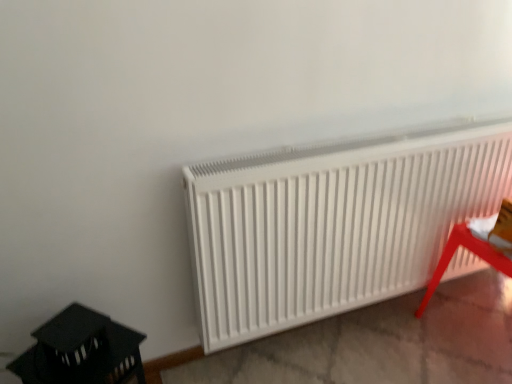
Identify the location of metallic red stool at lower right, which is counted as the 1th furniture, starting from the right. This screenshot has width=512, height=384. (476, 249).

Identify the location of white matte radiator at center. Image resolution: width=512 pixels, height=384 pixels. (333, 223).

Is black plastic lantern at lower left, which is the second furniture from right to left, looking in the opposite direction of metallic red stool at lower right, which is the second furniture in left-to-right order?

No, black plastic lantern at lower left, which is the second furniture from right to left,'s orientation is not away from metallic red stool at lower right, which is the second furniture in left-to-right order.

How many degrees apart are the facing directions of black plastic lantern at lower left, which appears as the 1th furniture when viewed from the left, and metallic red stool at lower right, which is counted as the 1th furniture, starting from the right?

41.2 degrees separate the facing orientations of black plastic lantern at lower left, which appears as the 1th furniture when viewed from the left, and metallic red stool at lower right, which is counted as the 1th furniture, starting from the right.

From a real-world perspective, is black plastic lantern at lower left, which is the second furniture from right to left, below metallic red stool at lower right, which is the second furniture in left-to-right order?

No.

Is there a large distance between black plastic lantern at lower left, which is the second furniture from right to left, and metallic red stool at lower right, which is counted as the 1th furniture, starting from the right?

Yes.

Is white matte radiator at center bigger than black plastic lantern at lower left, which is the second furniture from right to left?

Yes.

Is white matte radiator at center facing away from black plastic lantern at lower left, which appears as the 1th furniture when viewed from the left?

No.

From the picture: Does white matte radiator at center have a lesser height compared to black plastic lantern at lower left, which is the second furniture from right to left?

No.

Looking at this image, is black plastic lantern at lower left, which appears as the 1th furniture when viewed from the left, located within white matte radiator at center?

Actually, black plastic lantern at lower left, which appears as the 1th furniture when viewed from the left, is outside white matte radiator at center.

Considering the relative positions of white matte radiator at center and metallic red stool at lower right, which is counted as the 1th furniture, starting from the right, in the image provided, is white matte radiator at center to the left of metallic red stool at lower right, which is counted as the 1th furniture, starting from the right, from the viewer's perspective?

Yes, white matte radiator at center is to the left of metallic red stool at lower right, which is counted as the 1th furniture, starting from the right.

In the scene shown: Is metallic red stool at lower right, which is the second furniture in left-to-right order, a part of white matte radiator at center?

Actually, metallic red stool at lower right, which is the second furniture in left-to-right order, is outside white matte radiator at center.

From a real-world perspective, is white matte radiator at center physically located above or below metallic red stool at lower right, which is the second furniture in left-to-right order?

In terms of real-world spatial position, white matte radiator at center is above metallic red stool at lower right, which is the second furniture in left-to-right order.

Considering their positions, is white matte radiator at center located in front of or behind metallic red stool at lower right, which is the second furniture in left-to-right order?

Clearly, white matte radiator at center is in front of metallic red stool at lower right, which is the second furniture in left-to-right order.

Between black plastic lantern at lower left, which is the second furniture from right to left, and white matte radiator at center, which one has smaller size?

Smaller between the two is black plastic lantern at lower left, which is the second furniture from right to left.

Is black plastic lantern at lower left, which is the second furniture from right to left, closer to camera compared to white matte radiator at center?

Yes, black plastic lantern at lower left, which is the second furniture from right to left, is in front of white matte radiator at center.

Does point (95, 358) appear closer or farther from the camera than point (275, 273)?

Clearly, point (95, 358) is closer to the camera than point (275, 273).

Which object is positioned more to the right, black plastic lantern at lower left, which appears as the 1th furniture when viewed from the left, or white matte radiator at center?

From the viewer's perspective, white matte radiator at center appears more on the right side.

Could you measure the distance between metallic red stool at lower right, which is the second furniture in left-to-right order, and white matte radiator at center?

14.22 inches.

From the picture: From a real-world perspective, is metallic red stool at lower right, which is counted as the 1th furniture, starting from the right, on white matte radiator at center?

Actually, metallic red stool at lower right, which is counted as the 1th furniture, starting from the right, is physically below white matte radiator at center in the real world.

Is metallic red stool at lower right, which is the second furniture in left-to-right order, in front of or behind white matte radiator at center in the image?

Visually, metallic red stool at lower right, which is the second furniture in left-to-right order, is located behind white matte radiator at center.

Is metallic red stool at lower right, which is the second furniture in left-to-right order, in contact with white matte radiator at center?

No, metallic red stool at lower right, which is the second furniture in left-to-right order, is not next to white matte radiator at center.

Does metallic red stool at lower right, which is the second furniture in left-to-right order, turn towards black plastic lantern at lower left, which is the second furniture from right to left?

No, metallic red stool at lower right, which is the second furniture in left-to-right order, is not oriented towards black plastic lantern at lower left, which is the second furniture from right to left.

Does metallic red stool at lower right, which is the second furniture in left-to-right order, touch black plastic lantern at lower left, which is the second furniture from right to left?

They are not placed beside each other.

From the image's perspective, which one is positioned higher, metallic red stool at lower right, which is the second furniture in left-to-right order, or black plastic lantern at lower left, which is the second furniture from right to left?

metallic red stool at lower right, which is the second furniture in left-to-right order.

Does metallic red stool at lower right, which is the second furniture in left-to-right order, contain black plastic lantern at lower left, which is the second furniture from right to left?

No, black plastic lantern at lower left, which is the second furniture from right to left, is not a part of metallic red stool at lower right, which is the second furniture in left-to-right order.

In order to click on furniture that is on the left side of metallic red stool at lower right, which is counted as the 1th furniture, starting from the right in this screenshot , I will do `click(81, 350)`.

What are the coordinates of `radiator behind the black plastic lantern at lower left, which is the second furniture from right to left` in the screenshot? It's located at tap(333, 223).

Which object lies further to the anchor point white matte radiator at center, metallic red stool at lower right, which is counted as the 1th furniture, starting from the right, or black plastic lantern at lower left, which is the second furniture from right to left?

A: The object further to white matte radiator at center is black plastic lantern at lower left, which is the second furniture from right to left.

Looking at the image, which one is located closer to white matte radiator at center, black plastic lantern at lower left, which appears as the 1th furniture when viewed from the left, or metallic red stool at lower right, which is the second furniture in left-to-right order?

metallic red stool at lower right, which is the second furniture in left-to-right order.

Looking at the image, which one is located closer to black plastic lantern at lower left, which is the second furniture from right to left, white matte radiator at center or metallic red stool at lower right, which is counted as the 1th furniture, starting from the right?

Based on the image, white matte radiator at center appears to be nearer to black plastic lantern at lower left, which is the second furniture from right to left.

Estimate the real-world distances between objects in this image. Which object is closer to metallic red stool at lower right, which is counted as the 1th furniture, starting from the right, white matte radiator at center or black plastic lantern at lower left, which appears as the 1th furniture when viewed from the left?

white matte radiator at center is closer to metallic red stool at lower right, which is counted as the 1th furniture, starting from the right.

Looking at the image, which one is located further to black plastic lantern at lower left, which is the second furniture from right to left, metallic red stool at lower right, which is the second furniture in left-to-right order, or white matte radiator at center?

The object further to black plastic lantern at lower left, which is the second furniture from right to left, is metallic red stool at lower right, which is the second furniture in left-to-right order.

Which object lies further to the anchor point metallic red stool at lower right, which is counted as the 1th furniture, starting from the right, black plastic lantern at lower left, which is the second furniture from right to left, or white matte radiator at center?

black plastic lantern at lower left, which is the second furniture from right to left.

Identify the location of radiator located between black plastic lantern at lower left, which appears as the 1th furniture when viewed from the left, and metallic red stool at lower right, which is counted as the 1th furniture, starting from the right, in the left-right direction. The height and width of the screenshot is (384, 512). (333, 223).